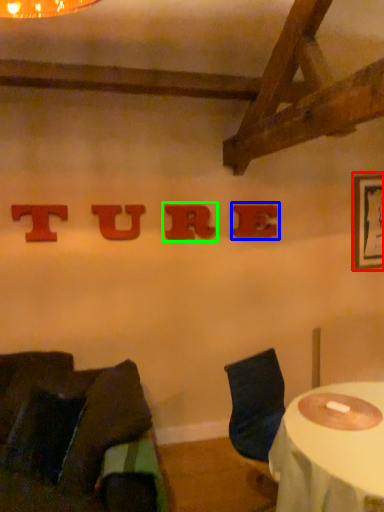
Question: Which object is the farthest from picture frame (highlighted by a red box)? Choose among these: alphabet (highlighted by a blue box) or alphabet (highlighted by a green box).

Choices:
 (A) alphabet
 (B) alphabet

Answer: (B)